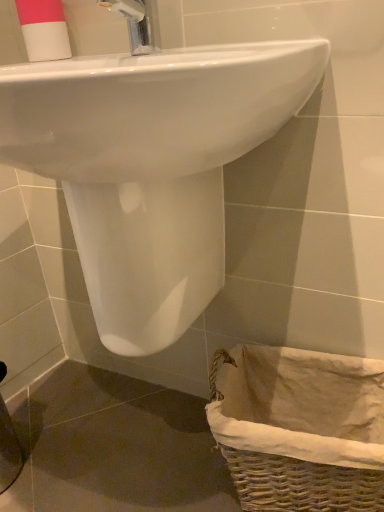
Question: Is woven wicker basket at lower right not inside white glossy sink at upper center?

Choices:
 (A) no
 (B) yes

Answer: (B)

Question: Is woven wicker basket at lower right in contact with white glossy sink at upper center?

Choices:
 (A) yes
 (B) no

Answer: (B)

Question: Would you say white glossy sink at upper center is part of woven wicker basket at lower right's contents?

Choices:
 (A) yes
 (B) no

Answer: (B)

Question: Is woven wicker basket at lower right behind white glossy sink at upper center?

Choices:
 (A) no
 (B) yes

Answer: (B)

Question: Is woven wicker basket at lower right aimed at white glossy sink at upper center?

Choices:
 (A) yes
 (B) no

Answer: (B)

Question: From the image's perspective, is white glossy sink at upper center above or below pink matte cup at upper left?

Choices:
 (A) below
 (B) above

Answer: (A)

Question: Relative to pink matte cup at upper left, is white glossy sink at upper center in front or behind?

Choices:
 (A) front
 (B) behind

Answer: (A)

Question: Do you think white glossy sink at upper center is within pink matte cup at upper left, or outside of it?

Choices:
 (A) inside
 (B) outside

Answer: (B)

Question: Considering the positions of white glossy sink at upper center and pink matte cup at upper left in the image, is white glossy sink at upper center taller or shorter than pink matte cup at upper left?

Choices:
 (A) short
 (B) tall

Answer: (B)

Question: From a real-world perspective, is woven wicker basket at lower right physically located above or below pink matte cup at upper left?

Choices:
 (A) above
 (B) below

Answer: (B)

Question: Is point (370, 414) positioned closer to the camera than point (56, 0)?

Choices:
 (A) farther
 (B) closer

Answer: (A)

Question: In the image, is woven wicker basket at lower right positioned in front of or behind pink matte cup at upper left?

Choices:
 (A) behind
 (B) front

Answer: (B)

Question: Considering the positions of woven wicker basket at lower right and pink matte cup at upper left in the image, is woven wicker basket at lower right wider or thinner than pink matte cup at upper left?

Choices:
 (A) wide
 (B) thin

Answer: (A)

Question: From a real-world perspective, is pink matte cup at upper left above or below white glossy sink at upper center?

Choices:
 (A) above
 (B) below

Answer: (A)

Question: Relative to white glossy sink at upper center, is pink matte cup at upper left in front or behind?

Choices:
 (A) front
 (B) behind

Answer: (B)